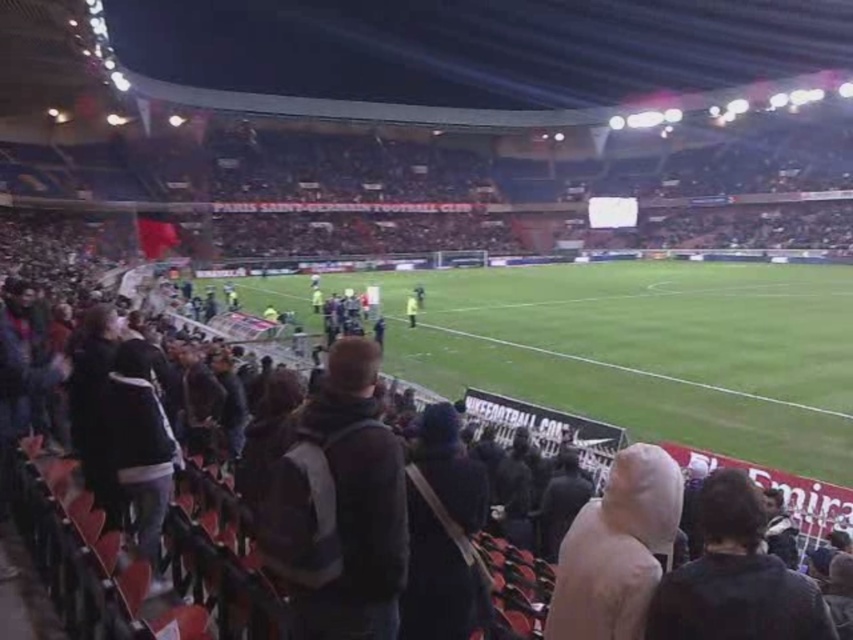
Question: Which point appears farthest from the camera in this image?

Choices:
 (A) (317, 394)
 (B) (810, 636)
 (C) (682, 384)

Answer: (C)

Question: Does green grass football field at center have a larger size compared to white matte hood at center?

Choices:
 (A) yes
 (B) no

Answer: (A)

Question: Is green grass football field at center thinner than dark gray backpack at center?

Choices:
 (A) yes
 (B) no

Answer: (B)

Question: Which point is farther from the camera taking this photo?

Choices:
 (A) (555, 300)
 (B) (355, 636)
 (C) (598, 600)
 (D) (646, 628)

Answer: (A)

Question: Can you confirm if green grass football field at center is bigger than white matte hood at center?

Choices:
 (A) yes
 (B) no

Answer: (A)

Question: Which object is positioned closest to the dark brown leather jacket at center?

Choices:
 (A) green grass football field at center
 (B) dark gray backpack at center
 (C) white matte hood at center

Answer: (C)